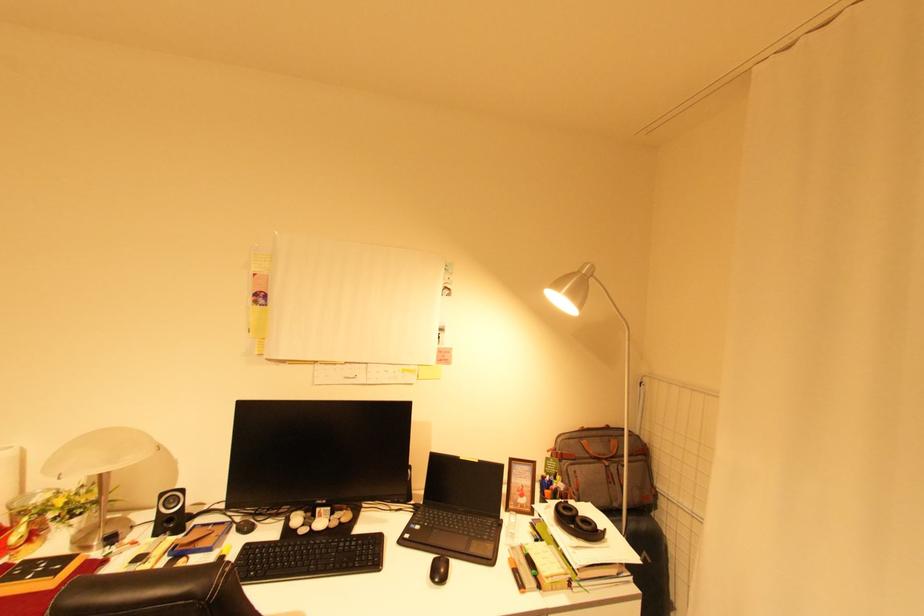
At what (x,y) coordinates should I click in order to perform the action: click on black laptop lid. Please return your answer as a coordinate pair (x, y). The width and height of the screenshot is (924, 616). Looking at the image, I should click on (464, 484).